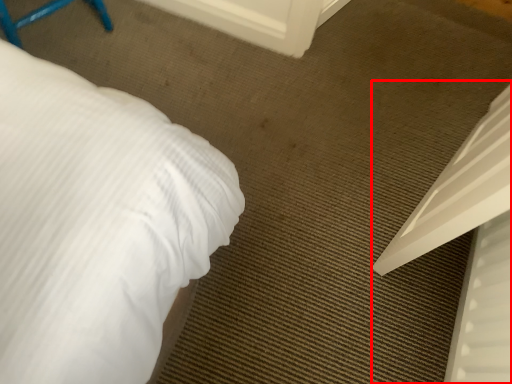
Question: From the image, what is the correct spatial relationship of bed (annotated by the red box) in relation to screen door?

Choices:
 (A) left
 (B) right

Answer: (B)